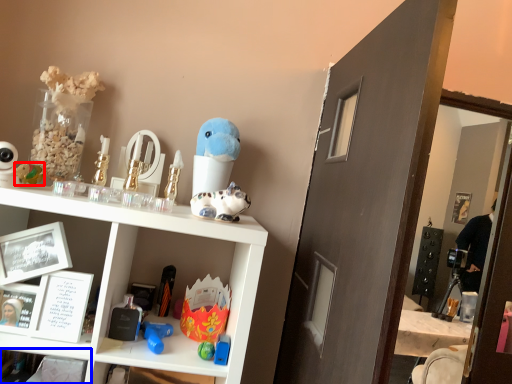
Question: Which of the following is the closest to the observer, toy (highlighted by a red box) or shelf (highlighted by a blue box)?

Choices:
 (A) toy
 (B) shelf

Answer: (B)